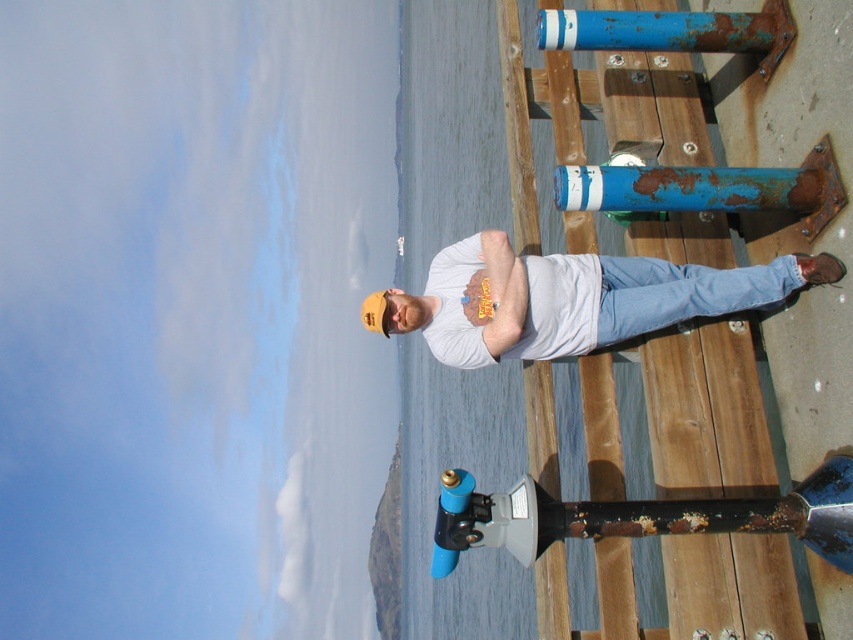
Question: Is the position of white cotton shirt at center less distant than that of blue matte pipe at lower center?

Choices:
 (A) no
 (B) yes

Answer: (A)

Question: Is white cotton shirt at center above blue matte pipe at lower center?

Choices:
 (A) no
 (B) yes

Answer: (B)

Question: Is white cotton shirt at center closer to camera compared to blue matte pipe at lower center?

Choices:
 (A) yes
 (B) no

Answer: (B)

Question: Which object appears closest to the camera in this image?

Choices:
 (A) white cotton shirt at center
 (B) blue matte pipe at lower center

Answer: (B)

Question: Which object is closer to the camera taking this photo?

Choices:
 (A) white cotton shirt at center
 (B) blue matte pipe at lower center

Answer: (B)